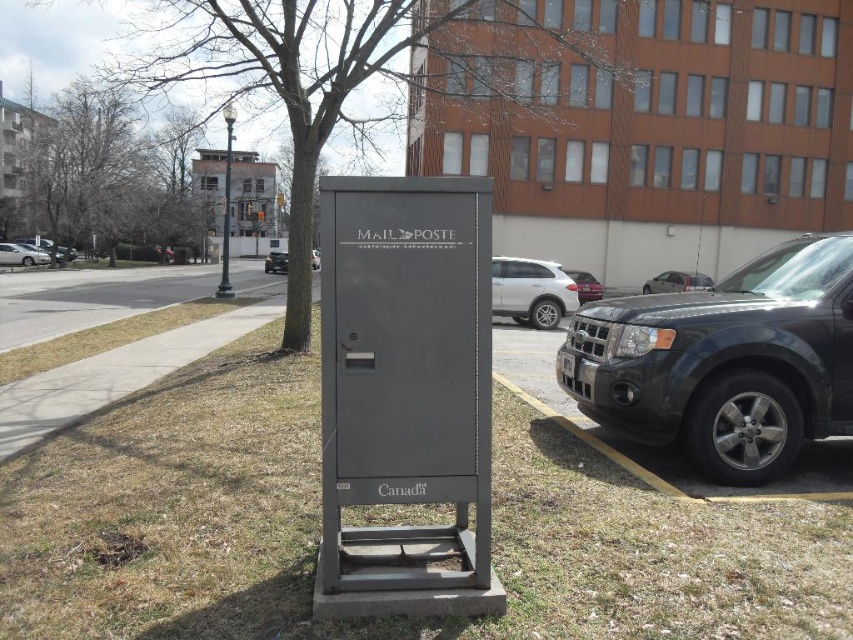
You are a delivery person standing at the origin point of a coordinate system. You need to place a new mailbox exactly 2 meters north of the existing metallic gray mailbox at center. What are the coordinates of the new mailbox location?

The coordinates of the new mailbox location would be calculated by moving 2 meters north from the original position at point [405,392]. However, without knowing the scale of the coordinate system, we cannot provide exact numerical coordinates for the new location.

You are standing at the point marked as point (318, 529). What do you see directly in front of you?

You see green grass at center directly in front of you at point (318, 529).